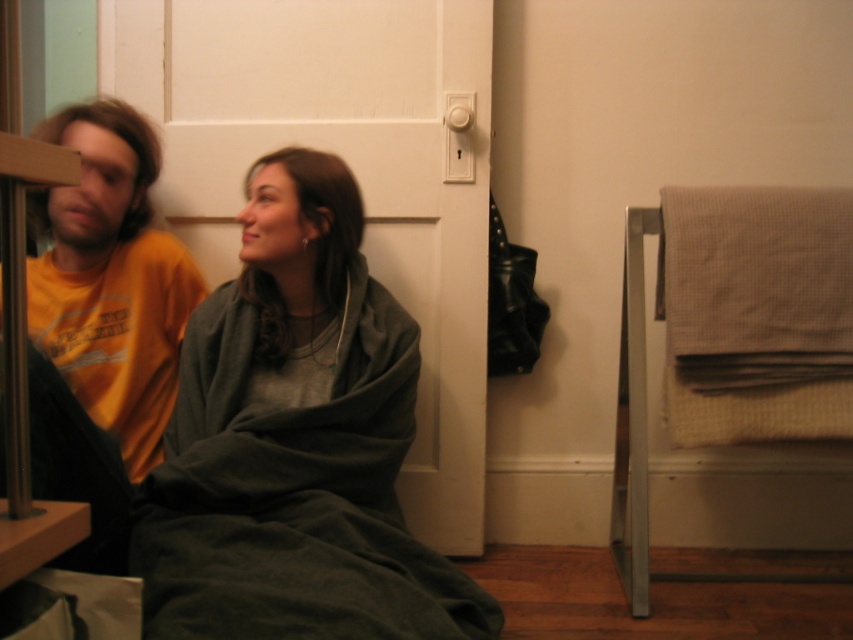
This screenshot has width=853, height=640. What do you see at coordinates (294, 442) in the screenshot?
I see `dark green fleece blanket at center` at bounding box center [294, 442].

Can you confirm if dark green fleece blanket at center is positioned to the right of beige textured towel at right?

In fact, dark green fleece blanket at center is to the left of beige textured towel at right.

Find the location of a particular element. This screenshot has width=853, height=640. dark green fleece blanket at center is located at coordinates (294, 442).

Where is `dark green fleece blanket at center`? dark green fleece blanket at center is located at coordinates (294, 442).

Can you confirm if dark green fleece blanket at center is positioned below orange t-shirt at left?

Yes.

Can you confirm if dark green fleece blanket at center is taller than orange t-shirt at left?

Yes, dark green fleece blanket at center is taller than orange t-shirt at left.

Is point (292, 168) positioned behind point (177, 288)?

No.

In order to click on dark green fleece blanket at center in this screenshot , I will do `click(294, 442)`.

Looking at this image, can you confirm if beige textured towel at right is positioned below orange t-shirt at left?

Correct, beige textured towel at right is located below orange t-shirt at left.

Can you confirm if beige textured towel at right is positioned to the left of orange t-shirt at left?

No, beige textured towel at right is not to the left of orange t-shirt at left.

Between point (840, 324) and point (53, 353), which one is positioned behind?

Point (840, 324)

The width and height of the screenshot is (853, 640). I want to click on beige textured towel at right, so click(x=756, y=314).